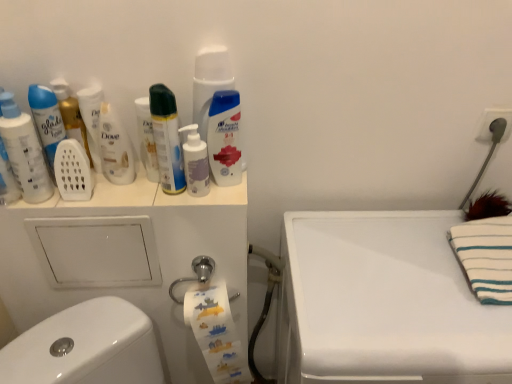
I want to click on vacant space to the right of white matte plastic mouthwash at upper left, arranged as the fourth mouthwash when viewed from the right, so click(176, 197).